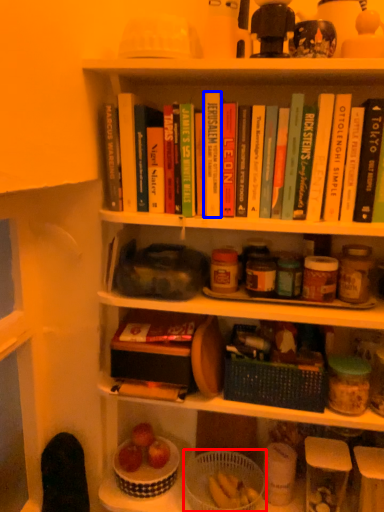
Question: Among these objects, which one is farthest to the camera, basket (highlighted by a red box) or paperback book (highlighted by a blue box)?

Choices:
 (A) basket
 (B) paperback book

Answer: (A)